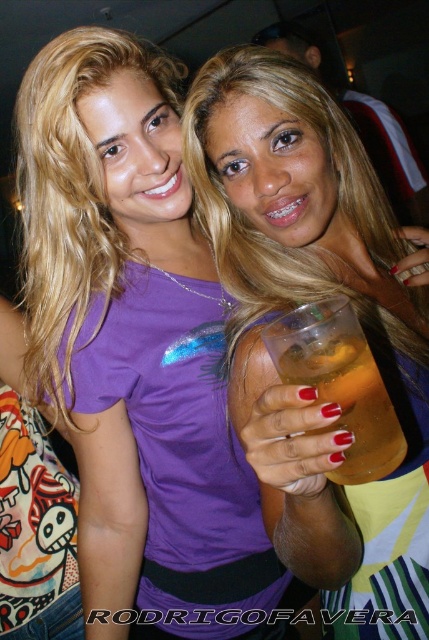
Consider the image. Is matte plastic cup at center below translucent plastic cup at center?

Actually, matte plastic cup at center is above translucent plastic cup at center.

Which of these two, matte plastic cup at center or translucent plastic cup at center, stands shorter?

Standing shorter between the two is translucent plastic cup at center.

What do you see at coordinates (307, 301) in the screenshot? Image resolution: width=429 pixels, height=640 pixels. I see `matte plastic cup at center` at bounding box center [307, 301].

Locate an element on the screen. This screenshot has height=640, width=429. matte plastic cup at center is located at coordinates (307, 301).